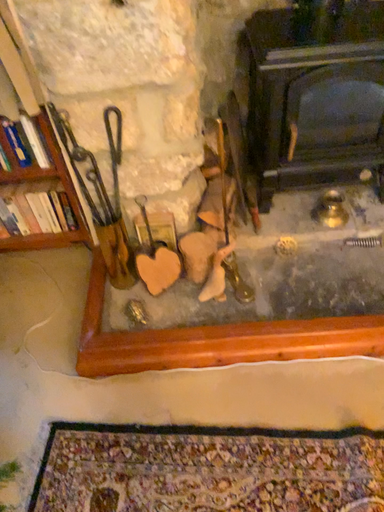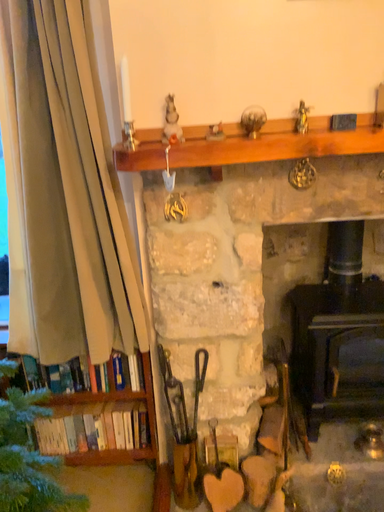
Question: How did the camera likely rotate when shooting the video?

Choices:
 (A) rotated upward
 (B) rotated downward

Answer: (A)